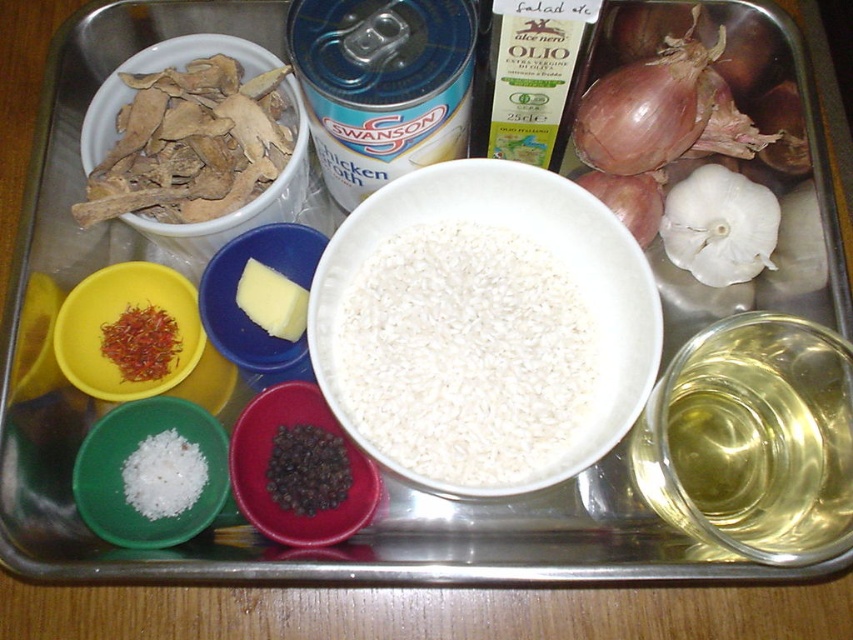
Consider the image. Does brown matte onion at upper right have a smaller size compared to yellow creamy cheese at center?

No.

Is point (699, 129) closer to viewer compared to point (257, 323)?

No, it is not.

Does point (683, 113) lie in front of point (286, 310)?

No, (683, 113) is further to viewer.

Image resolution: width=853 pixels, height=640 pixels. Find the location of `brown matte onion at upper right`. brown matte onion at upper right is located at coordinates (648, 106).

Consider the image. Does dark red plastic bowl at center have a greater height compared to yellow creamy cheese at center?

Indeed, dark red plastic bowl at center has a greater height compared to yellow creamy cheese at center.

Between point (259, 492) and point (293, 310), which one is positioned in front?

Point (259, 492) is in front.

Identify the location of dark red plastic bowl at center. (277, 476).

Is white matte salt at center left in front of white matte onion at upper right?

Yes, white matte salt at center left is closer to the viewer.

Which is behind, point (71, 484) or point (618, 182)?

The point (618, 182) is more distant.

Locate an element on the screen. white matte salt at center left is located at coordinates (126, 458).